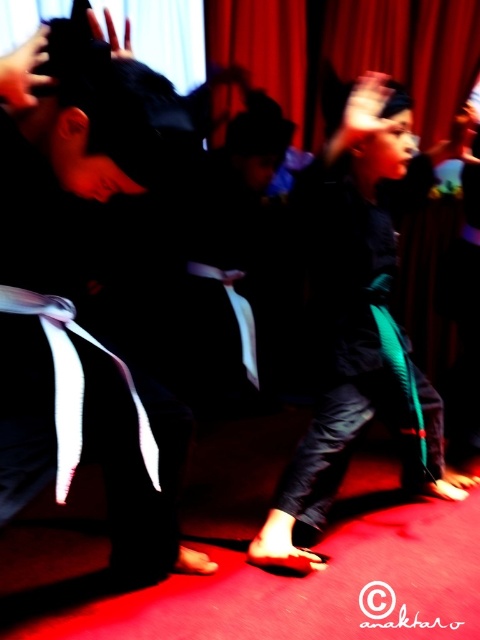
You are a martial arts instructor observing the scene. You notice a point at coordinates (81, 291). What object is located at this point?

The point at coordinates (81, 291) corresponds to the matte black belt at left.

You are a photographer standing at the center of the stage. You want to adjust your camera to focus on the matte black belt at left. What are the coordinates where you should aim your camera?

The coordinates to focus on the matte black belt at left are at point (81, 291).

In the scene shown: You are a photographer positioned at the center of the stage in the martial arts scene. You want to take a photo that includes both the point at coordinates point (101, 355) and point (287, 477). Which point should you focus on first to ensure both are in sharp focus?

You should focus on point (101, 355) first because it is closer to the viewer, ensuring that both points will be in focus when using a proper depth of field.